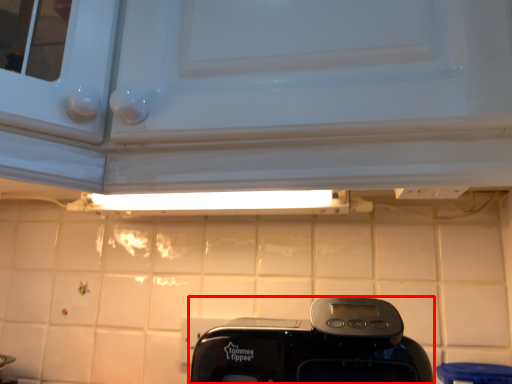
Question: From the image, what is the correct spatial relationship of home appliance (annotated by the red box) in relation to tile?

Choices:
 (A) left
 (B) right

Answer: (B)